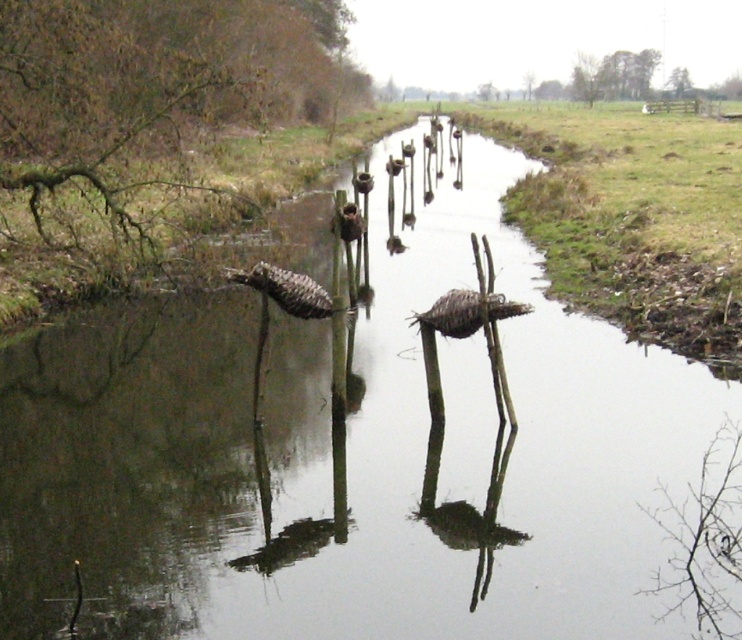
You are a bird flying over the rural scene and want to choose a nesting spot between the green leafy tree at upper right and the green leafy tree at upper center. Which tree would you choose if you prefer a taller nesting spot?

The green leafy tree at upper center is taller than the green leafy tree at upper right, so you should choose the green leafy tree at upper center for a taller nesting spot.